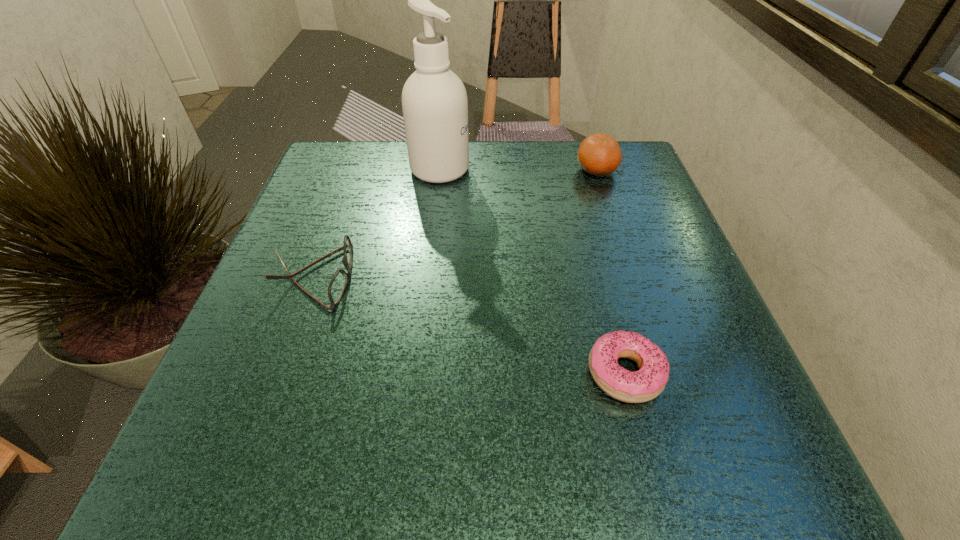
The width and height of the screenshot is (960, 540). Identify the location of cleansing agent that is positioned at the far edge. (434, 101).

Where is `clementine that is at the far edge`? clementine that is at the far edge is located at coordinates (599, 154).

You are a GUI agent. You are given a task and a screenshot of the screen. Output one action in this format:
    pyautogui.click(x=<x>, y=<y>)
    Task: Click on the object present at the left edge
    
    Given the screenshot: What is the action you would take?
    pyautogui.click(x=338, y=283)

Identify the location of clementine that is at the right edge. This screenshot has width=960, height=540. (599, 154).

Find the location of `doughnut located in the right edge section of the desktop`. doughnut located in the right edge section of the desktop is located at coordinates (649, 381).

Locate an element on the screen. object that is at the far right corner is located at coordinates (599, 154).

Find the location of a particular element. vacant space at the far edge of the desktop is located at coordinates (568, 158).

The width and height of the screenshot is (960, 540). I want to click on vacant space at the near edge, so click(x=537, y=468).

In the image, there is a desktop. Where is `free space at the left edge`? The image size is (960, 540). free space at the left edge is located at coordinates (359, 253).

The width and height of the screenshot is (960, 540). Identify the location of vacant space at the right edge of the desktop. (634, 238).